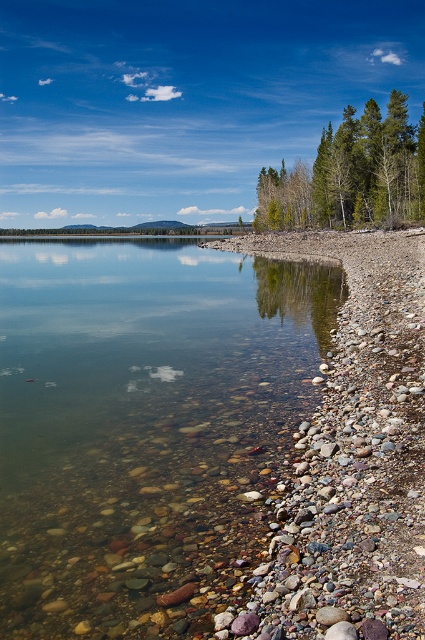
Does point (99, 413) lie behind point (387, 134)?

No, (99, 413) is closer to viewer.

Who is taller, clear water at center or green textured trees at upper right?

With more height is green textured trees at upper right.

At what (x,y) coordinates should I click in order to perform the action: click on clear water at center. Please return your answer as a coordinate pair (x, y). This screenshot has width=425, height=640. Looking at the image, I should click on (147, 428).

You are a GUI agent. You are given a task and a screenshot of the screen. Output one action in this format:
    pyautogui.click(x=<x>, y=<y>)
    Task: Click on the clear water at center
    
    Given the screenshot: What is the action you would take?
    click(x=147, y=428)